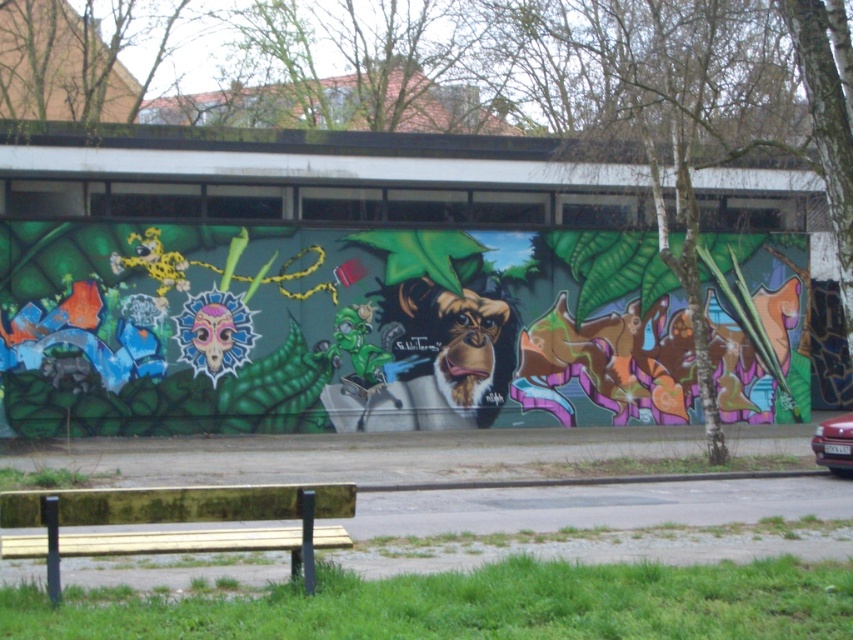
Does wooden bench at lower left appear under shiny red car at right?

No.

Does wooden bench at lower left have a greater height compared to shiny red car at right?

Yes.

The height and width of the screenshot is (640, 853). What are the coordinates of `wooden bench at lower left` in the screenshot? It's located at (177, 522).